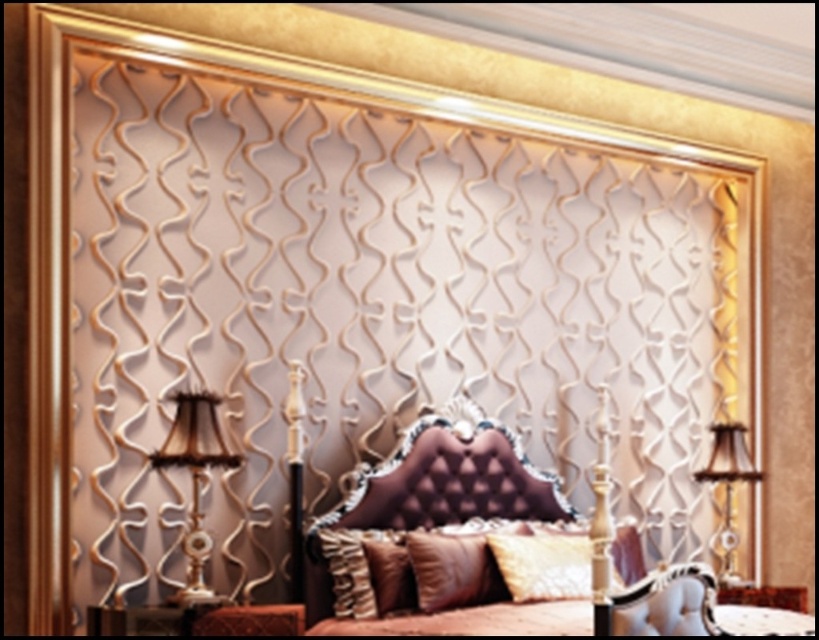
Question: Can you confirm if satin gold pillow at center is positioned above velvet gold pillow at center?

Choices:
 (A) no
 (B) yes

Answer: (B)

Question: Considering the relative positions of gold textured lamp at left and brown velvet pillow at center in the image provided, where is gold textured lamp at left located with respect to brown velvet pillow at center?

Choices:
 (A) below
 (B) above

Answer: (B)

Question: Can you confirm if brown velvet headboard at center is bigger than satin gold pillow at center?

Choices:
 (A) yes
 (B) no

Answer: (A)

Question: Among these objects, which one is nearest to the camera?

Choices:
 (A) velvet brown pillow at center
 (B) brown suede pillow at center

Answer: (B)

Question: Which point appears farthest from the camera in this image?

Choices:
 (A) (725, 460)
 (B) (392, 588)

Answer: (A)

Question: Which object is the farthest from the gold textured lamp at left?

Choices:
 (A) velvet gold pillow at center
 (B) velvet brown pillow at center

Answer: (A)